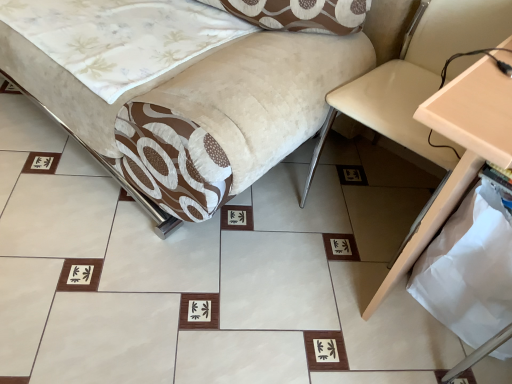
You are a GUI agent. You are given a task and a screenshot of the screen. Output one action in this format:
    pyautogui.click(x=<x>, y=<y>)
    Task: Click on the vacant area situated below beige leather swivel chair at right (from a real-world perspective)
    Image resolution: width=512 pixels, height=384 pixels.
    Given the screenshot: What is the action you would take?
    pyautogui.click(x=376, y=193)